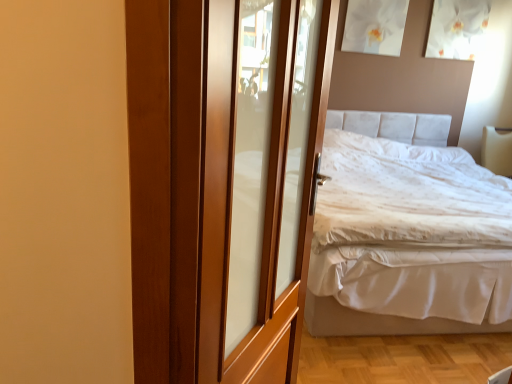
Question: Is white fabric bed at right at the left side of wooden door at center?

Choices:
 (A) yes
 (B) no

Answer: (B)

Question: Considering the relative sizes of white fabric bed at right and wooden door at center in the image provided, is white fabric bed at right smaller than wooden door at center?

Choices:
 (A) no
 (B) yes

Answer: (A)

Question: Can you confirm if white fabric bed at right is thinner than wooden door at center?

Choices:
 (A) no
 (B) yes

Answer: (A)

Question: Is wooden door at center inside white fabric bed at right?

Choices:
 (A) no
 (B) yes

Answer: (A)

Question: From the image's perspective, is white fabric bed at right below wooden door at center?

Choices:
 (A) no
 (B) yes

Answer: (A)

Question: Is white fabric bed at right outside of wooden door at center?

Choices:
 (A) yes
 (B) no

Answer: (A)

Question: Is wooden door at center directly adjacent to white fabric bed at right?

Choices:
 (A) no
 (B) yes

Answer: (A)

Question: Can you confirm if wooden door at center is taller than white fabric bed at right?

Choices:
 (A) yes
 (B) no

Answer: (A)

Question: Considering the relative positions of wooden door at center and white fabric bed at right in the image provided, is wooden door at center to the left of white fabric bed at right from the viewer's perspective?

Choices:
 (A) yes
 (B) no

Answer: (A)

Question: Does wooden door at center have a larger size compared to white fabric bed at right?

Choices:
 (A) yes
 (B) no

Answer: (B)

Question: From a real-world perspective, is wooden door at center under white fabric bed at right?

Choices:
 (A) yes
 (B) no

Answer: (B)

Question: From the image's perspective, does wooden door at center appear lower than white fabric bed at right?

Choices:
 (A) no
 (B) yes

Answer: (B)

Question: Would you say wooden door at center is inside or outside white fabric bed at right?

Choices:
 (A) outside
 (B) inside

Answer: (A)